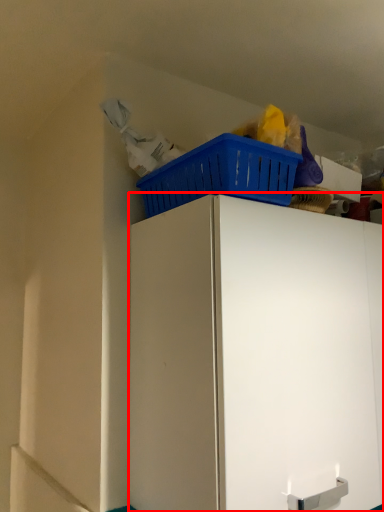
Question: Where is cabinetry (annotated by the red box) located in relation to basket in the image?

Choices:
 (A) right
 (B) left

Answer: (A)